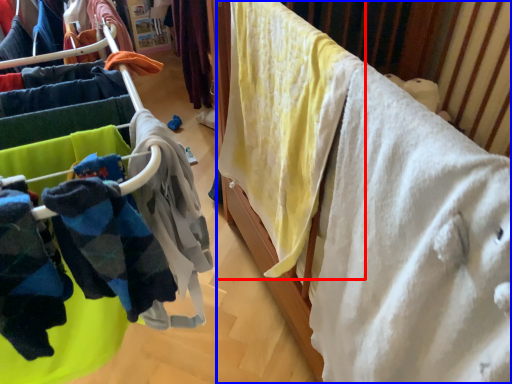
Question: Which point is closer to the camera, clothing (highlighted by a red box) or furniture (highlighted by a blue box)?

Choices:
 (A) clothing
 (B) furniture

Answer: (B)